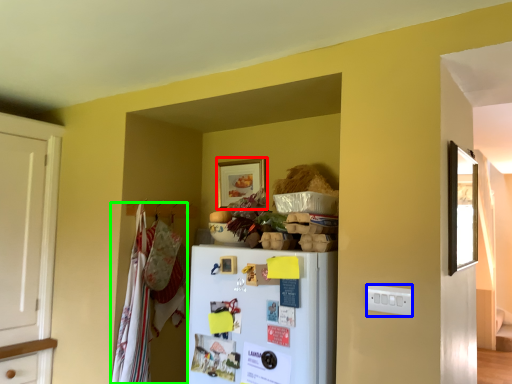
Question: Estimate the real-world distances between objects in this image. Which object is closer to picture frame (highlighted by a red box), electric outlet (highlighted by a blue box) or laundry (highlighted by a green box)?

Choices:
 (A) electric outlet
 (B) laundry

Answer: (B)